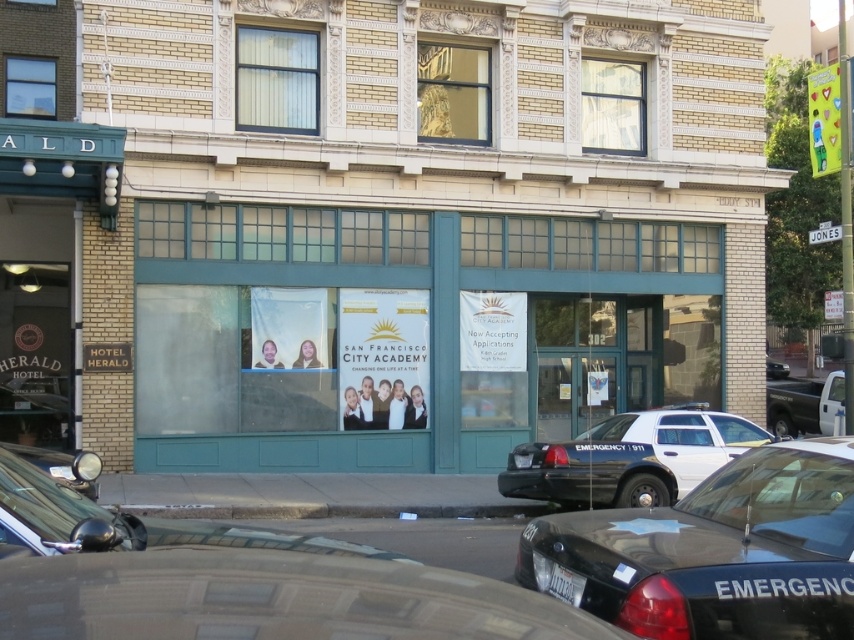
Question: Can you confirm if metallic silver truck at right is positioned below black glossy sedan at right?

Choices:
 (A) no
 (B) yes

Answer: (B)

Question: Based on their relative distances, which object is nearer to the metallic silver truck at right?

Choices:
 (A) black glossy sedan at right
 (B) black glossy emergency vehicle at lower center
 (C) black/white emergency vehicle at center

Answer: (A)

Question: Can you confirm if black glossy emergency vehicle at lower center is wider than metallic silver truck at right?

Choices:
 (A) no
 (B) yes

Answer: (B)

Question: Does black/white emergency vehicle at center appear on the left side of black glossy sedan at right?

Choices:
 (A) yes
 (B) no

Answer: (A)

Question: Which point appears closest to the camera in this image?

Choices:
 (A) (785, 376)
 (B) (741, 529)
 (C) (796, 387)
 (D) (650, 432)

Answer: (B)

Question: Considering the real-world distances, which object is closest to the black glossy emergency vehicle at lower center?

Choices:
 (A) black glossy sedan at right
 (B) metallic silver truck at right
 (C) black/white emergency vehicle at center

Answer: (C)